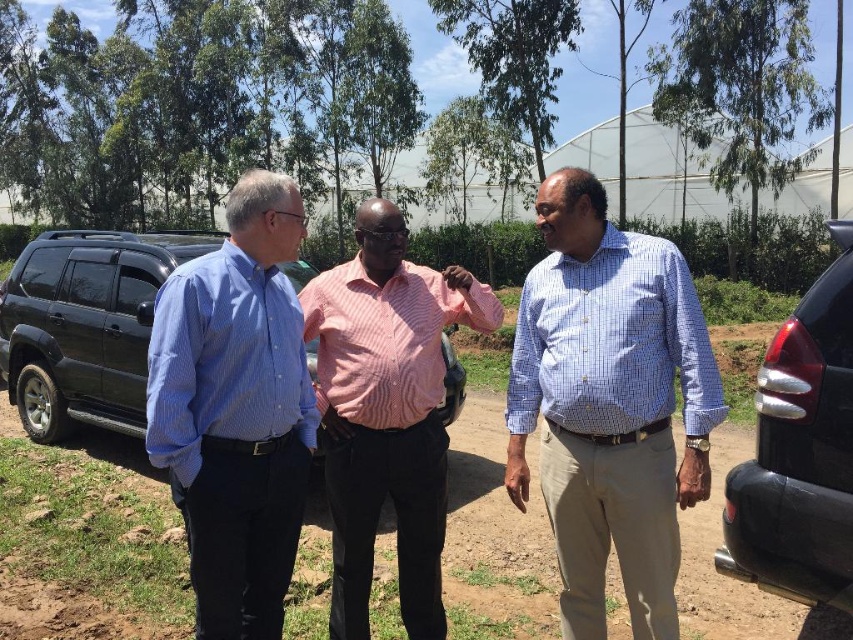
Between blue checkered shirt at center and glossy black car at right, which one appears on the right side from the viewer's perspective?

glossy black car at right is more to the right.

The image size is (853, 640). What do you see at coordinates (608, 404) in the screenshot?
I see `blue checkered shirt at center` at bounding box center [608, 404].

Find the location of a particular element. The image size is (853, 640). blue checkered shirt at center is located at coordinates (608, 404).

Where is `blue checkered shirt at center`? The width and height of the screenshot is (853, 640). blue checkered shirt at center is located at coordinates (608, 404).

Which of these two, blue striped shirt at left or glossy black car at right, stands taller?

Standing taller between the two is blue striped shirt at left.

Between blue striped shirt at left and glossy black car at right, which one appears on the right side from the viewer's perspective?

glossy black car at right is more to the right.

Image resolution: width=853 pixels, height=640 pixels. In order to click on blue striped shirt at left in this screenshot , I will do `click(236, 410)`.

Can you confirm if blue checkered shirt at center is smaller than pink striped shirt at center?

Correct, blue checkered shirt at center occupies less space than pink striped shirt at center.

Describe the element at coordinates (608, 404) in the screenshot. This screenshot has width=853, height=640. I see `blue checkered shirt at center` at that location.

Consider the image. Who is more distant from viewer, (577, 182) or (325, 442)?

Positioned behind is point (325, 442).

This screenshot has height=640, width=853. Identify the location of blue checkered shirt at center. (608, 404).